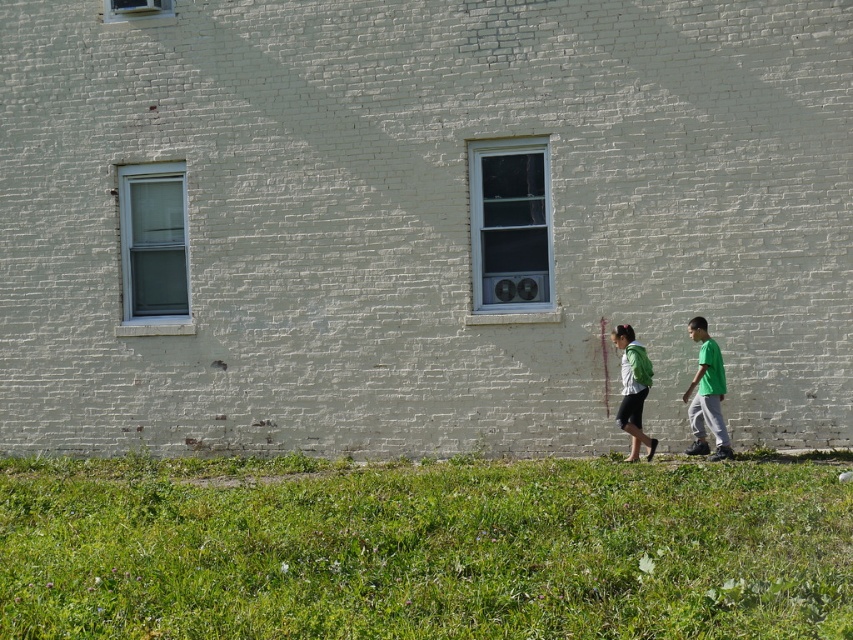
You are standing in front of a white brick building with two windows. You notice two points marked on the ground at coordinates point (720,369) and point (637,372). Which point is closer to the building?

Point (720,369) is in front of point (637,372), so point (637,372) is closer to the building.

You are a gardener looking at the white brick building with two windows. You notice the green grass at lower center and the green matte shirt at right. Which object takes up more space in the scene?

The green matte shirt at right occupies more space than the green grass at lower center.